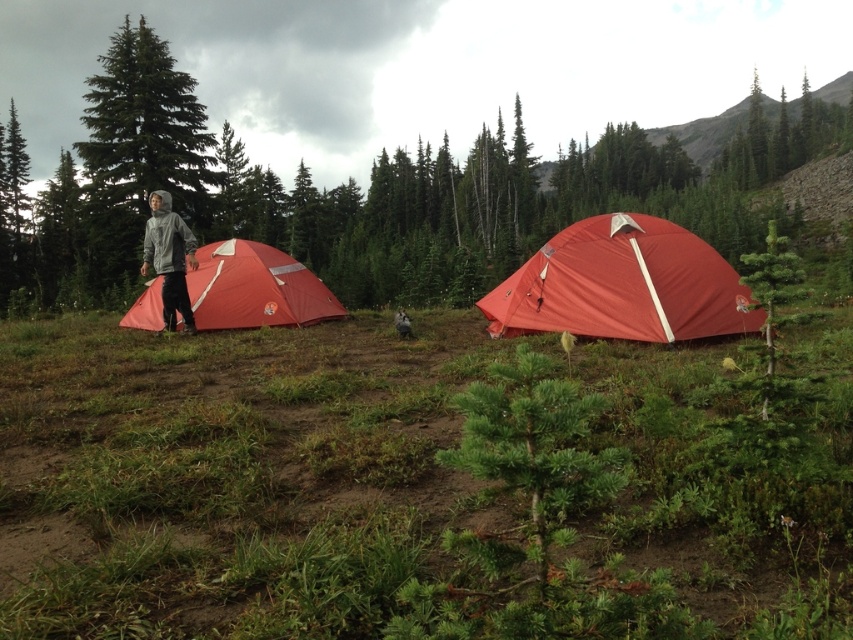
Is matte red tent at left shorter than gray fleece jacket at left?

Indeed, matte red tent at left has a lesser height compared to gray fleece jacket at left.

Between matte red tent at left and gray fleece jacket at left, which one has less height?

With less height is matte red tent at left.

This screenshot has height=640, width=853. What are the coordinates of `matte red tent at left` in the screenshot? It's located at (254, 289).

Who is positioned more to the right, matte red tent at center or matte red tent at left?

matte red tent at center

Where is `matte red tent at center`? This screenshot has width=853, height=640. matte red tent at center is located at coordinates (622, 284).

Who is higher up, matte red tent at center or gray fleece jacket at left?

gray fleece jacket at left

Between matte red tent at center and gray fleece jacket at left, which one appears on the left side from the viewer's perspective?

gray fleece jacket at left is more to the left.

Who is more distant from viewer, (547, 269) or (183, 221)?

Positioned behind is point (183, 221).

Identify the location of matte red tent at center. The width and height of the screenshot is (853, 640). (622, 284).